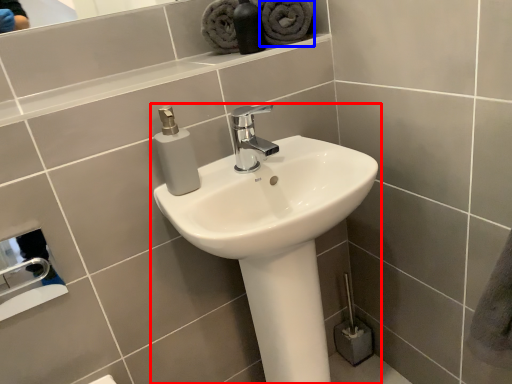
Question: Which object is closer to the camera taking this photo, sink (highlighted by a red box) or bath towel (highlighted by a blue box)?

Choices:
 (A) sink
 (B) bath towel

Answer: (A)